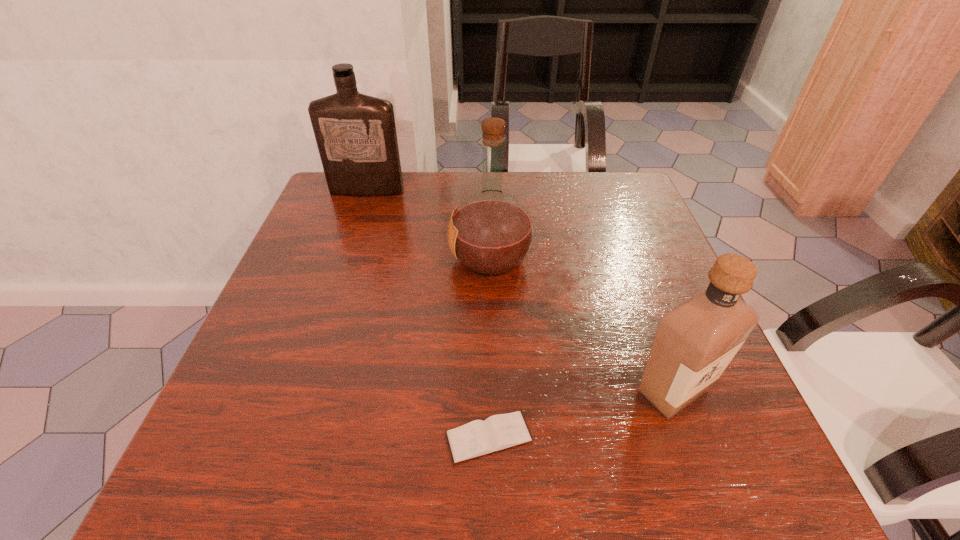
Locate an element on the screen. the farthest liquor is located at coordinates (355, 133).

At what (x,y) coordinates should I click in order to perform the action: click on the leftmost liquor. Please return your answer as a coordinate pair (x, y). The height and width of the screenshot is (540, 960). Looking at the image, I should click on (355, 133).

Image resolution: width=960 pixels, height=540 pixels. In order to click on the second nearest liquor in this screenshot , I will do (491, 232).

Where is `the second liquor from left to right`? the second liquor from left to right is located at coordinates (491, 232).

The image size is (960, 540). Find the location of `the rightmost liquor`. the rightmost liquor is located at coordinates (694, 342).

The width and height of the screenshot is (960, 540). Identify the location of the nearest liquor. (694, 342).

What are the coordinates of `diary` in the screenshot? It's located at (478, 438).

Locate an element on the screen. The height and width of the screenshot is (540, 960). free location located on the label side of the farthest liquor is located at coordinates (359, 214).

Locate an element on the screen. vacant region located 0.220m on the front label of the third nearest object is located at coordinates (351, 258).

Where is `free point located on the front label of the third nearest object`? free point located on the front label of the third nearest object is located at coordinates (383, 258).